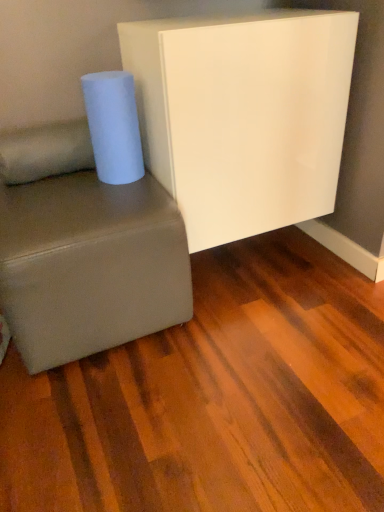
Question: Is white glossy board at upper center not near white matte paper towel at left?

Choices:
 (A) no
 (B) yes

Answer: (A)

Question: From the image's perspective, does white glossy board at upper center appear lower than white matte paper towel at left?

Choices:
 (A) no
 (B) yes

Answer: (A)

Question: Is white glossy board at upper center closer to the viewer compared to white matte paper towel at left?

Choices:
 (A) yes
 (B) no

Answer: (A)

Question: Can you confirm if white glossy board at upper center is positioned to the right of white matte paper towel at left?

Choices:
 (A) yes
 (B) no

Answer: (A)

Question: Is white matte paper towel at left inside white glossy board at upper center?

Choices:
 (A) yes
 (B) no

Answer: (B)

Question: Does white glossy board at upper center have a greater width compared to white matte paper towel at left?

Choices:
 (A) yes
 (B) no

Answer: (A)

Question: From a real-world perspective, is suede-like gray studio couch at lower left beneath white glossy board at upper center?

Choices:
 (A) yes
 (B) no

Answer: (A)

Question: Considering the relative sizes of suede-like gray studio couch at lower left and white glossy board at upper center in the image provided, is suede-like gray studio couch at lower left wider than white glossy board at upper center?

Choices:
 (A) no
 (B) yes

Answer: (B)

Question: Is the surface of suede-like gray studio couch at lower left in direct contact with white glossy board at upper center?

Choices:
 (A) yes
 (B) no

Answer: (B)

Question: Can you confirm if suede-like gray studio couch at lower left is thinner than white glossy board at upper center?

Choices:
 (A) no
 (B) yes

Answer: (A)

Question: Is suede-like gray studio couch at lower left closer to camera compared to white glossy board at upper center?

Choices:
 (A) yes
 (B) no

Answer: (A)

Question: Can you confirm if suede-like gray studio couch at lower left is taller than white glossy board at upper center?

Choices:
 (A) yes
 (B) no

Answer: (B)

Question: Is soft beige fabric pillow at lower left to the left of suede-like gray studio couch at lower left from the viewer's perspective?

Choices:
 (A) no
 (B) yes

Answer: (B)